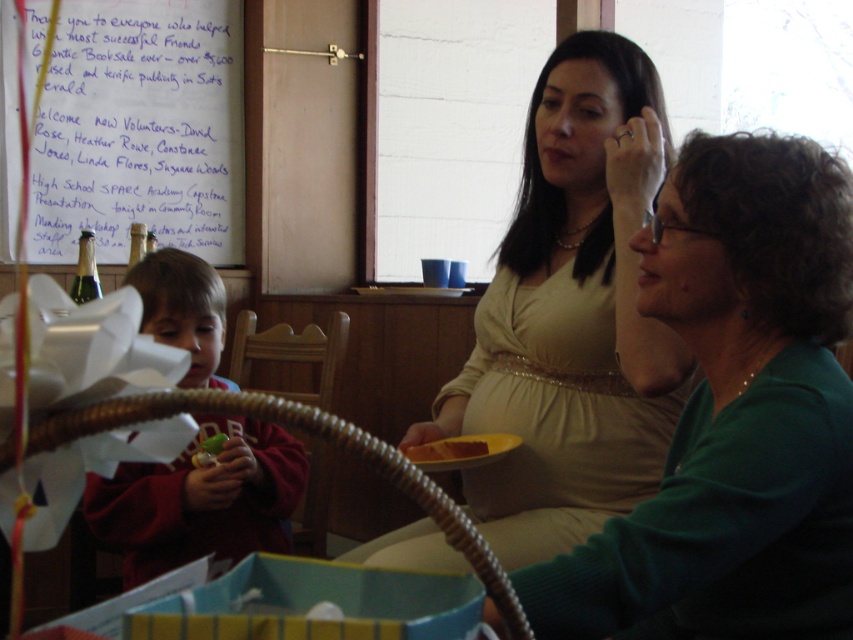
Does whiteboard at upper left have a smaller size compared to matte red hoodie at left?

No, whiteboard at upper left is not smaller than matte red hoodie at left.

Who is more distant from viewer, (173, 93) or (212, 314)?

Positioned behind is point (173, 93).

The height and width of the screenshot is (640, 853). Find the location of `whiteboard at upper left`. whiteboard at upper left is located at coordinates (140, 129).

Does whiteboard at upper left appear on the right side of yellow cake at center?

In fact, whiteboard at upper left is to the left of yellow cake at center.

Based on the photo, is whiteboard at upper left shorter than yellow cake at center?

No.

Locate an element on the screen. whiteboard at upper left is located at coordinates (140, 129).

Between green matte sweater at center and matte red hoodie at left, which one has more height?

green matte sweater at center is taller.

Identify the location of green matte sweater at center. (735, 413).

Who is more forward, (631, 545) or (223, 552)?

Positioned in front is point (631, 545).

Where is `green matte sweater at center`? Image resolution: width=853 pixels, height=640 pixels. green matte sweater at center is located at coordinates (735, 413).